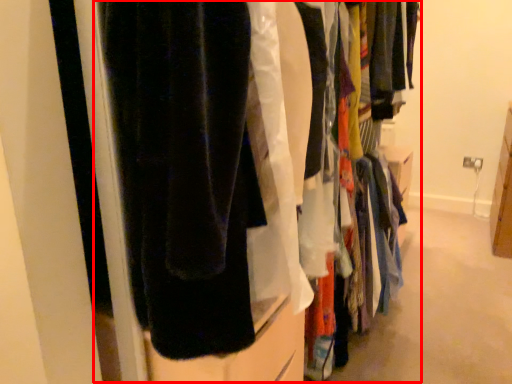
Question: Where is closet (annotated by the red box) located in relation to closet in the image?

Choices:
 (A) right
 (B) left

Answer: (B)